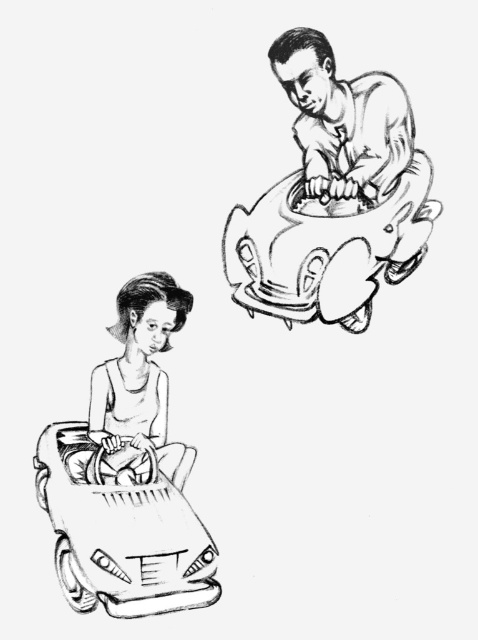
You are a character in the image and want to move from your current position to the smooth plastic toy car at upper right. Based on the coordinates provided, in which direction should you move relative to the image?

The smooth plastic toy car at upper right is located at coordinates 0.392 on the x axis and 0.684 on the y axis. Since the image coordinate system typically starts from the bottom left corner, moving towards the upper right would mean increasing both x and y values. However, since the car is already at upper right, you would need to move towards the upper right direction to reach it.